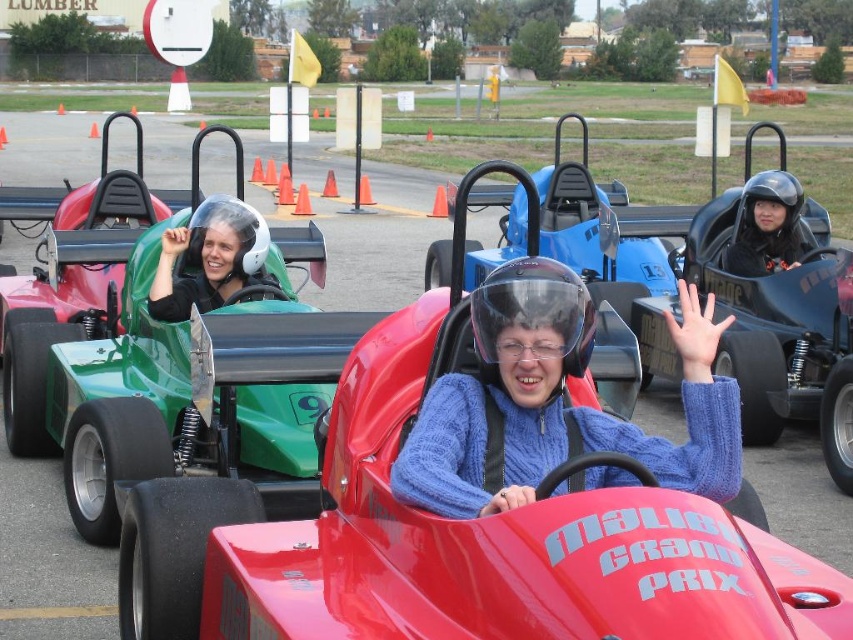
Does matte black helmet at upper center appear on the right side of black helmet at center?

No, matte black helmet at upper center is not to the right of black helmet at center.

How distant is matte black helmet at upper center from black helmet at center?

matte black helmet at upper center and black helmet at center are 4.38 meters apart from each other.

The height and width of the screenshot is (640, 853). I want to click on matte black helmet at upper center, so click(x=209, y=259).

Based on the photo, can you confirm if blue knitted sweater at center is bigger than black helmet at center?

Indeed, blue knitted sweater at center has a larger size compared to black helmet at center.

Between point (709, 493) and point (798, 256), which one is positioned in front?

Positioned in front is point (709, 493).

Does point (592, 324) come in front of point (799, 193)?

Yes, it is.

I want to click on blue knitted sweater at center, so click(x=556, y=403).

Is blue knitted sweater at center behind matte black helmet at upper center?

No.

Who is taller, blue knitted sweater at center or matte black helmet at upper center?

blue knitted sweater at center is taller.

Is point (532, 410) in front of point (187, 259)?

Yes.

Locate an element on the screen. This screenshot has height=640, width=853. blue knitted sweater at center is located at coordinates (556, 403).